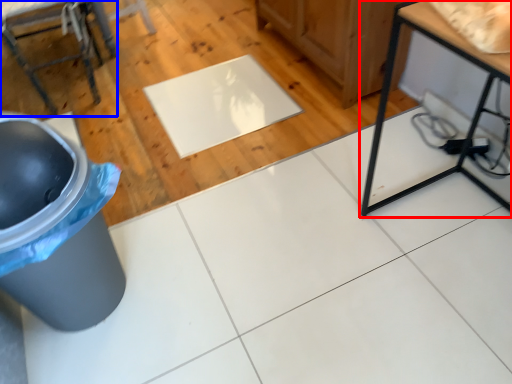
Question: Which object appears farthest to the camera in this image, table (highlighted by a red box) or furniture (highlighted by a blue box)?

Choices:
 (A) table
 (B) furniture

Answer: (B)